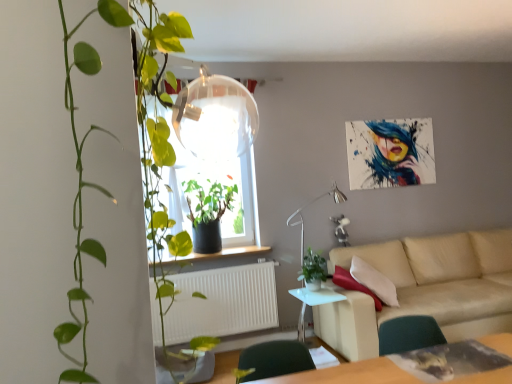
Question: Is green matte plant at window, the 3th houseplant positioned from the front, positioned in front of smooth wooden window sill at center?

Choices:
 (A) no
 (B) yes

Answer: (B)

Question: From a real-world perspective, is green matte plant at window, the 3th houseplant positioned from the front, positioned over smooth wooden window sill at center based on gravity?

Choices:
 (A) yes
 (B) no

Answer: (A)

Question: Is green matte plant at window, the 3th houseplant positioned from the front, to the left of smooth wooden window sill at center from the viewer's perspective?

Choices:
 (A) yes
 (B) no

Answer: (A)

Question: Does green matte plant at window, the first houseplant from the back, have a greater height compared to smooth wooden window sill at center?

Choices:
 (A) yes
 (B) no

Answer: (A)

Question: Considering the relative sizes of green matte plant at window, the 3th houseplant positioned from the front, and smooth wooden window sill at center in the image provided, is green matte plant at window, the 3th houseplant positioned from the front, smaller than smooth wooden window sill at center?

Choices:
 (A) yes
 (B) no

Answer: (B)

Question: From the image's perspective, does green matte plant at window, the 3th houseplant positioned from the front, appear lower than smooth wooden window sill at center?

Choices:
 (A) yes
 (B) no

Answer: (B)

Question: Is green matte plant at window, the 3th houseplant positioned from the front, in front of metallic silver lamp at center?

Choices:
 (A) no
 (B) yes

Answer: (A)

Question: From a real-world perspective, does green matte plant at window, the first houseplant from the back, stand above metallic silver lamp at center?

Choices:
 (A) no
 (B) yes

Answer: (B)

Question: Considering the relative sizes of green matte plant at window, the 3th houseplant positioned from the front, and metallic silver lamp at center in the image provided, is green matte plant at window, the 3th houseplant positioned from the front, thinner than metallic silver lamp at center?

Choices:
 (A) yes
 (B) no

Answer: (B)

Question: Would you say green matte plant at window, the 3th houseplant positioned from the front, contains metallic silver lamp at center?

Choices:
 (A) yes
 (B) no

Answer: (B)

Question: Is green matte plant at window, the 3th houseplant positioned from the front, in contact with metallic silver lamp at center?

Choices:
 (A) yes
 (B) no

Answer: (B)

Question: From a real-world perspective, is green matte plant at window, the first houseplant from the back, beneath metallic silver lamp at center?

Choices:
 (A) yes
 (B) no

Answer: (B)

Question: Does white glossy side table at lower center lie behind smooth wooden window sill at center?

Choices:
 (A) yes
 (B) no

Answer: (B)